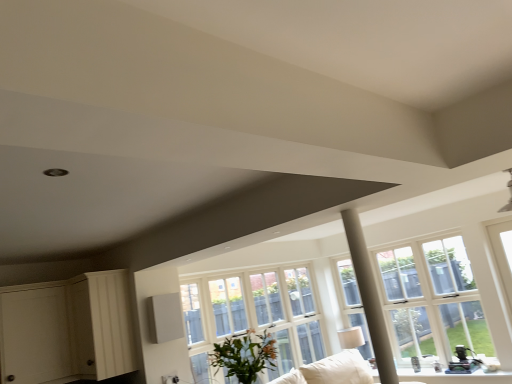
Measure the distance between green leafy plant at center and camera.

green leafy plant at center and camera are 9.15 feet apart from each other.

You are a GUI agent. You are given a task and a screenshot of the screen. Output one action in this format:
    pyautogui.click(x=<x>, y=<y>)
    Task: Click on the white fabric couch at lower center
    This screenshot has width=512, height=384.
    Given the screenshot: What is the action you would take?
    pyautogui.click(x=331, y=371)

Based on the photo, what is the approximate width of white fabric couch at lower center?

white fabric couch at lower center is 34.01 inches in width.

Locate an element on the screen. This screenshot has height=384, width=512. green leafy plant at center is located at coordinates (244, 356).

Based on their positions, is green leafy plant at center located to the left or right of white fabric couch at lower center?

From the image, it's evident that green leafy plant at center is to the left of white fabric couch at lower center.

Is green leafy plant at center thinner than white fabric couch at lower center?

Indeed, green leafy plant at center has a lesser width compared to white fabric couch at lower center.

From the image's perspective, is green leafy plant at center above or below white fabric couch at lower center?

green leafy plant at center is above white fabric couch at lower center.

Does point (258, 355) come in front of point (292, 376)?

Yes, point (258, 355) is closer to viewer.

From the picture: Is white fabric couch at lower center behind white wood dresser at lower left?

Yes, the depth of white fabric couch at lower center is greater than that of white wood dresser at lower left.

Is white fabric couch at lower center taller or shorter than white wood dresser at lower left?

white fabric couch at lower center is shorter than white wood dresser at lower left.

Is white fabric couch at lower center facing towards white wood dresser at lower left?

No, white fabric couch at lower center does not turn towards white wood dresser at lower left.

Can you confirm if white fabric couch at lower center is wider than white wood dresser at lower left?

Indeed, white fabric couch at lower center has a greater width compared to white wood dresser at lower left.

This screenshot has width=512, height=384. Identify the location of window below the white wood dresser at lower left (from the image's perspective). (431, 301).

Is the depth of white wood dresser at lower left greater than that of clear glass window at center?

No, it is not.

In terms of size, does white wood dresser at lower left appear bigger or smaller than clear glass window at center?

Considering their sizes, white wood dresser at lower left takes up less space than clear glass window at center.

Is white wood dresser at lower left oriented towards clear glass window at center?

No.

Is white wood dresser at lower left completely or partially outside of green leafy plant at center?

Absolutely, white wood dresser at lower left is external to green leafy plant at center.

From a real-world perspective, between white wood dresser at lower left and green leafy plant at center, who is vertically higher?

white wood dresser at lower left is physically above.

From the image's perspective, between white wood dresser at lower left and green leafy plant at center, who is located below?

green leafy plant at center, from the image's perspective.

Considering the sizes of objects white wood dresser at lower left and green leafy plant at center in the image provided, who is wider, white wood dresser at lower left or green leafy plant at center?

With larger width is white wood dresser at lower left.

Between clear glass window at center and green leafy plant at center, which one has larger width?

green leafy plant at center is wider.

Where is `houseplant that appears in front of the clear glass window at center`? houseplant that appears in front of the clear glass window at center is located at coordinates pyautogui.click(x=244, y=356).

Is green leafy plant at center a part of clear glass window at center?

Actually, green leafy plant at center is outside clear glass window at center.

Based on the photo, is the position of green leafy plant at center less distant than that of clear glass window at center?

Yes, it is in front of clear glass window at center.

From a real-world perspective, between green leafy plant at center and clear glass window at center, who is vertically lower?

green leafy plant at center, from a real-world perspective.

Is green leafy plant at center beside clear glass window at center?

No, green leafy plant at center is not touching clear glass window at center.

Does green leafy plant at center contain clear glass window at center?

No.

Would you say white fabric couch at lower center is to the left or to the right of green leafy plant at center in the picture?

In the image, white fabric couch at lower center appears on the right side of green leafy plant at center.

Locate an element on the screen. This screenshot has width=512, height=384. couch below the green leafy plant at center (from a real-world perspective) is located at coordinates coord(331,371).

From a real-world perspective, between white fabric couch at lower center and green leafy plant at center, who is vertically higher?

green leafy plant at center.

Identify the location of houseplant on the left side of white fabric couch at lower center. The width and height of the screenshot is (512, 384). (244, 356).

The height and width of the screenshot is (384, 512). I want to click on dresser located in front of the white fabric couch at lower center, so click(67, 329).

From the image, which object appears to be nearer to white wood dresser at lower left, white fabric couch at lower center or green leafy plant at center?

Among the two, green leafy plant at center is located nearer to white wood dresser at lower left.

Estimate the real-world distances between objects in this image. Which object is further from white wood dresser at lower left, clear glass window at center or green leafy plant at center?

clear glass window at center lies further to white wood dresser at lower left than the other object.

From the image, which object appears to be farther from white fabric couch at lower center, white wood dresser at lower left or clear glass window at center?

Among the two, clear glass window at center is located further to white fabric couch at lower center.

From the picture: From the image, which object appears to be farther from clear glass window at center, white wood dresser at lower left or white fabric couch at lower center?

white wood dresser at lower left.

Based on their spatial positions, is white wood dresser at lower left or white fabric couch at lower center further from green leafy plant at center?

white fabric couch at lower center.

Looking at the image, which one is located closer to white fabric couch at lower center, white wood dresser at lower left or green leafy plant at center?

green leafy plant at center.

Based on their spatial positions, is white fabric couch at lower center or clear glass window at center further from white wood dresser at lower left?

Among the two, clear glass window at center is located further to white wood dresser at lower left.

When comparing their distances from white fabric couch at lower center, does green leafy plant at center or clear glass window at center seem further?

clear glass window at center is positioned further to the anchor white fabric couch at lower center.

Image resolution: width=512 pixels, height=384 pixels. I want to click on couch between green leafy plant at center and clear glass window at center in the front-back direction, so click(x=331, y=371).

The width and height of the screenshot is (512, 384). What are the coordinates of `houseplant situated between white wood dresser at lower left and clear glass window at center from left to right` in the screenshot? It's located at (244, 356).

Locate an element on the screen. couch between white wood dresser at lower left and clear glass window at center from left to right is located at coordinates (331, 371).

The width and height of the screenshot is (512, 384). What are the coordinates of `houseplant located between white wood dresser at lower left and white fabric couch at lower center in the left-right direction` in the screenshot? It's located at (244, 356).